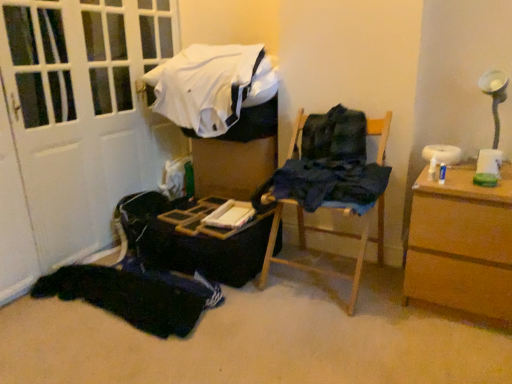
Image resolution: width=512 pixels, height=384 pixels. Describe the element at coordinates (84, 111) in the screenshot. I see `white matte door at left` at that location.

Locate an element on the screen. The width and height of the screenshot is (512, 384). wooden chair at center is located at coordinates (326, 233).

What is the approximate height of white cotton shirt at upper center, the 1th clothing from the top?

white cotton shirt at upper center, the 1th clothing from the top, is 49.08 centimeters in height.

Locate an element on the screen. Image resolution: width=512 pixels, height=384 pixels. white cotton shirt at upper center, acting as the 3th clothing starting from the bottom is located at coordinates (212, 87).

Identify the location of black fabric at lower left, placed as the 1th clothing when sorted from bottom to top. The height and width of the screenshot is (384, 512). (135, 295).

Is black fabric at lower left, which appears as the 3th clothing when viewed from the top, inside or outside of dark blue fabric at center, the second clothing from the top?

The correct answer is: outside.

From the picture: From a real-world perspective, is black fabric at lower left, which appears as the 3th clothing when viewed from the top, physically above dark blue fabric at center, the second clothing from the top?

No, from a real-world perspective, black fabric at lower left, which appears as the 3th clothing when viewed from the top, is not over dark blue fabric at center, the second clothing from the top

From the image's perspective, who appears lower, black fabric at lower left, placed as the 1th clothing when sorted from bottom to top, or dark blue fabric at center, the second clothing from the top?

black fabric at lower left, placed as the 1th clothing when sorted from bottom to top, appears lower in the image.

Find the location of a particular element. chest of drawers lying on the right of dark blue fabric at center, the second clothing from the top is located at coordinates (461, 245).

Which of these two, brown wooden chest of drawers at right or dark blue fabric at center, acting as the 2th clothing starting from the bottom, is bigger?

brown wooden chest of drawers at right is bigger.

Is brown wooden chest of drawers at right positioned far away from dark blue fabric at center, acting as the 2th clothing starting from the bottom?

No, brown wooden chest of drawers at right is not far from dark blue fabric at center, acting as the 2th clothing starting from the bottom.

Based on the photo, which object is positioned more to the right, brown wooden chest of drawers at right or dark blue fabric at center, acting as the 2th clothing starting from the bottom?

Positioned to the right is brown wooden chest of drawers at right.

Between white matte door at left and brown wooden chest of drawers at right, which one has larger width?

white matte door at left is wider.

Is the position of white matte door at left more distant than that of brown wooden chest of drawers at right?

No, white matte door at left is closer to the camera.

Is white matte door at left touching brown wooden chest of drawers at right?

There is a gap between white matte door at left and brown wooden chest of drawers at right.

From a real-world perspective, which is physically below, white matte door at left or brown wooden chest of drawers at right?

In real-world perspective, brown wooden chest of drawers at right is lower.

How different are the orientations of black fabric at lower left, which appears as the 3th clothing when viewed from the top, and brown wooden chest of drawers at right in degrees?

The facing directions of black fabric at lower left, which appears as the 3th clothing when viewed from the top, and brown wooden chest of drawers at right are 93.3 degrees apart.

From the image's perspective, is black fabric at lower left, placed as the 1th clothing when sorted from bottom to top, under brown wooden chest of drawers at right?

Correct, black fabric at lower left, placed as the 1th clothing when sorted from bottom to top, appears lower than brown wooden chest of drawers at right in the image.

Are black fabric at lower left, which appears as the 3th clothing when viewed from the top, and brown wooden chest of drawers at right beside each other?

No, black fabric at lower left, which appears as the 3th clothing when viewed from the top, is not beside brown wooden chest of drawers at right.

Who is taller, black fabric at lower left, placed as the 1th clothing when sorted from bottom to top, or brown wooden chest of drawers at right?

Standing taller between the two is brown wooden chest of drawers at right.

At what (x,y) coordinates should I click in order to perform the action: click on chest of drawers lying on the right of dark blue fabric at center, acting as the 2th clothing starting from the bottom. Please return your answer as a coordinate pair (x, y). Looking at the image, I should click on (461, 245).

Considering the sizes of objects dark blue fabric at center, acting as the 2th clothing starting from the bottom, and brown wooden chest of drawers at right in the image provided, who is smaller, dark blue fabric at center, acting as the 2th clothing starting from the bottom, or brown wooden chest of drawers at right?

Smaller between the two is dark blue fabric at center, acting as the 2th clothing starting from the bottom.

Is dark blue fabric at center, the second clothing from the top, beside brown wooden chest of drawers at right?

No, dark blue fabric at center, the second clothing from the top, is not in contact with brown wooden chest of drawers at right.

From the image's perspective, is dark blue fabric at center, acting as the 2th clothing starting from the bottom, under brown wooden chest of drawers at right?

No.

What's the angular difference between black fabric at lower left, which appears as the 3th clothing when viewed from the top, and white cotton shirt at upper center, the 1th clothing from the top,'s facing directions?

88.7 degrees.

Which object is positioned more to the left, black fabric at lower left, which appears as the 3th clothing when viewed from the top, or white cotton shirt at upper center, acting as the 3th clothing starting from the bottom?

Positioned to the left is black fabric at lower left, which appears as the 3th clothing when viewed from the top.

Could white cotton shirt at upper center, the 1th clothing from the top, be considered to be inside black fabric at lower left, placed as the 1th clothing when sorted from bottom to top?

No, white cotton shirt at upper center, the 1th clothing from the top, is located outside of black fabric at lower left, placed as the 1th clothing when sorted from bottom to top.

Looking at this image, how far apart are black fabric at lower left, which appears as the 3th clothing when viewed from the top, and white cotton shirt at upper center, acting as the 3th clothing starting from the bottom?

The distance of black fabric at lower left, which appears as the 3th clothing when viewed from the top, from white cotton shirt at upper center, acting as the 3th clothing starting from the bottom, is 35.46 inches.

From the image's perspective, is white cotton shirt at upper center, the 1th clothing from the top, below dark blue fabric at center, the second clothing from the top?

Incorrect, from the image's perspective, white cotton shirt at upper center, the 1th clothing from the top, is higher than dark blue fabric at center, the second clothing from the top.

Is white cotton shirt at upper center, the 1th clothing from the top, to the left of dark blue fabric at center, acting as the 2th clothing starting from the bottom, from the viewer's perspective?

Yes, white cotton shirt at upper center, the 1th clothing from the top, is to the left of dark blue fabric at center, acting as the 2th clothing starting from the bottom.

From a real-world perspective, is white cotton shirt at upper center, acting as the 3th clothing starting from the bottom, physically located above or below dark blue fabric at center, acting as the 2th clothing starting from the bottom?

In terms of real-world spatial position, white cotton shirt at upper center, acting as the 3th clothing starting from the bottom, is above dark blue fabric at center, acting as the 2th clothing starting from the bottom.

What are the coordinates of `clothing below the dark blue fabric at center, the second clothing from the top (from the image's perspective)` in the screenshot? It's located at (135, 295).

At what (x,y) coordinates should I click in order to perform the action: click on clothing that is the 1st one when counting upward from the brown wooden chest of drawers at right (from the image's perspective). Please return your answer as a coordinate pair (x, y). The width and height of the screenshot is (512, 384). Looking at the image, I should click on (330, 183).

Which object lies further to the anchor point wooden chair at center, white cotton shirt at upper center, acting as the 3th clothing starting from the bottom, or white matte door at left?

Among the two, white matte door at left is located further to wooden chair at center.

From the image, which object appears to be nearer to dark blue fabric at center, acting as the 2th clothing starting from the bottom, white cotton shirt at upper center, acting as the 3th clothing starting from the bottom, or white matte door at left?

Based on the image, white cotton shirt at upper center, acting as the 3th clothing starting from the bottom, appears to be nearer to dark blue fabric at center, acting as the 2th clothing starting from the bottom.

Considering their positions, is dark blue fabric at center, the second clothing from the top, positioned closer to black fabric at lower left, placed as the 1th clothing when sorted from bottom to top, than wooden chair at center?

wooden chair at center is positioned closer to the anchor black fabric at lower left, placed as the 1th clothing when sorted from bottom to top.

Which object lies further to the anchor point white matte door at left, wooden chair at center or black fabric at lower left, placed as the 1th clothing when sorted from bottom to top?

Among the two, wooden chair at center is located further to white matte door at left.

Which object lies further to the anchor point black fabric at lower left, placed as the 1th clothing when sorted from bottom to top, white cotton shirt at upper center, the 1th clothing from the top, or wooden chair at center?

white cotton shirt at upper center, the 1th clothing from the top, lies further to black fabric at lower left, placed as the 1th clothing when sorted from bottom to top, than the other object.

Estimate the real-world distances between objects in this image. Which object is further from white cotton shirt at upper center, acting as the 3th clothing starting from the bottom, dark blue fabric at center, the second clothing from the top, or wooden chair at center?

wooden chair at center is further to white cotton shirt at upper center, acting as the 3th clothing starting from the bottom.

From the image, which object appears to be farther from white matte door at left, white cotton shirt at upper center, the 1th clothing from the top, or brown wooden chest of drawers at right?

The object further to white matte door at left is brown wooden chest of drawers at right.

Looking at this image, from the image, which object appears to be farther from dark blue fabric at center, the second clothing from the top, black fabric at lower left, placed as the 1th clothing when sorted from bottom to top, or white cotton shirt at upper center, acting as the 3th clothing starting from the bottom?

black fabric at lower left, placed as the 1th clothing when sorted from bottom to top.

You are a GUI agent. You are given a task and a screenshot of the screen. Output one action in this format:
    pyautogui.click(x=<x>, y=<y>)
    Task: Click on the clothing that lies between white cotton shirt at upper center, acting as the 3th clothing starting from the bottom, and black fabric at lower left, which appears as the 3th clothing when viewed from the top, from top to bottom
    This screenshot has height=384, width=512.
    Given the screenshot: What is the action you would take?
    pyautogui.click(x=330, y=183)

The image size is (512, 384). In order to click on furniture situated between dark blue fabric at center, acting as the 2th clothing starting from the bottom, and brown wooden chest of drawers at right from left to right in this screenshot , I will do `click(326, 233)`.

Find the location of `door between white cotton shirt at upper center, acting as the 3th clothing starting from the bottom, and black fabric at lower left, which appears as the 3th clothing when viewed from the top, from top to bottom`. door between white cotton shirt at upper center, acting as the 3th clothing starting from the bottom, and black fabric at lower left, which appears as the 3th clothing when viewed from the top, from top to bottom is located at coordinates (84, 111).

At what (x,y) coordinates should I click in order to perform the action: click on clothing between white cotton shirt at upper center, acting as the 3th clothing starting from the bottom, and brown wooden chest of drawers at right, in the horizontal direction. Please return your answer as a coordinate pair (x, y). This screenshot has height=384, width=512. Looking at the image, I should click on (330, 183).